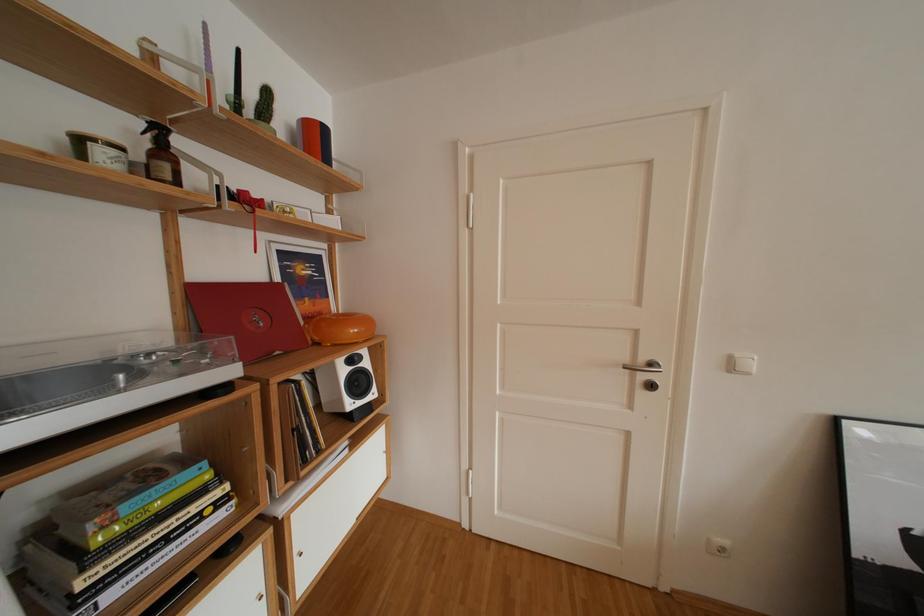
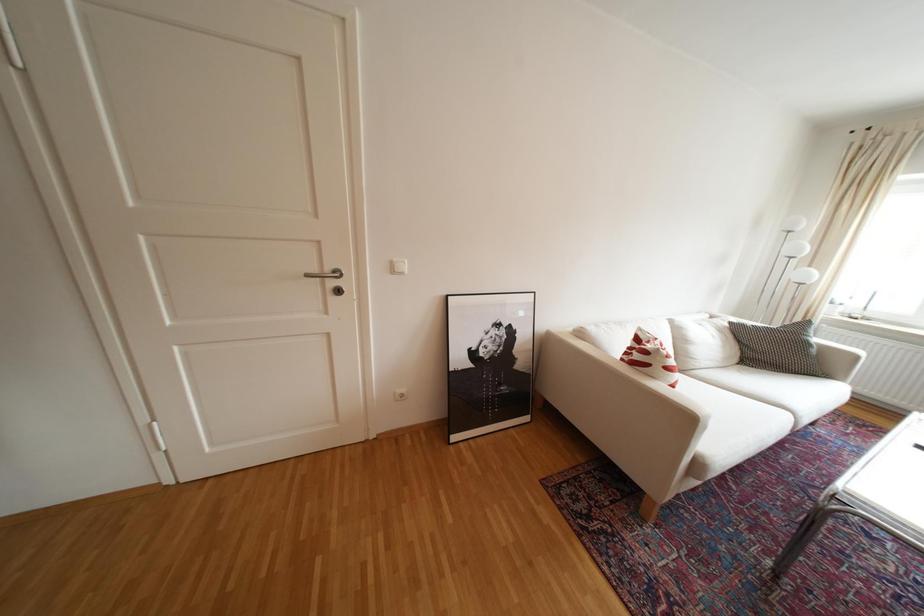
Question: The camera is either moving clockwise (left) or counter-clockwise (right) around the object. The first image is from the beginning of the video and the second image is from the end. Is the camera moving left or right when shooting the video?

Choices:
 (A) Left
 (B) Right

Answer: (A)